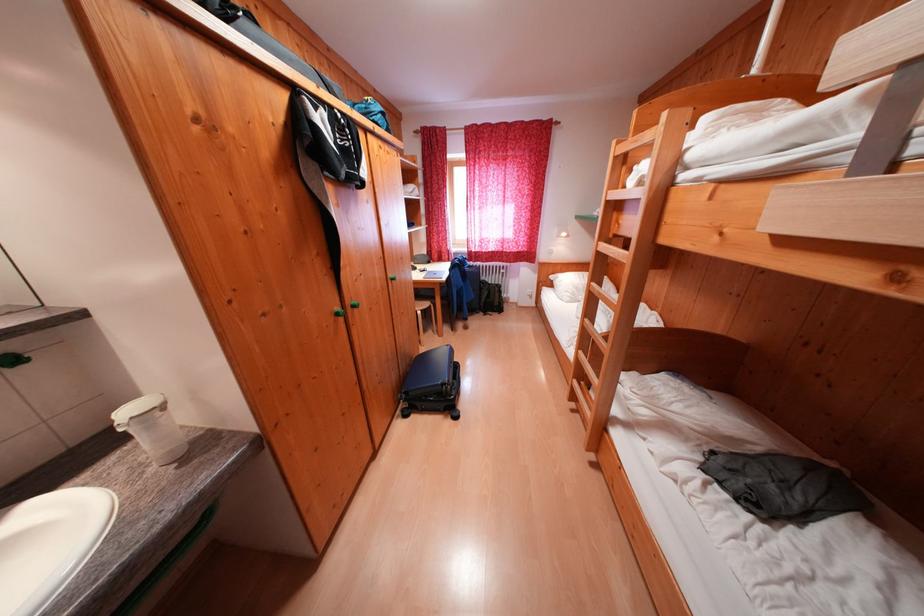
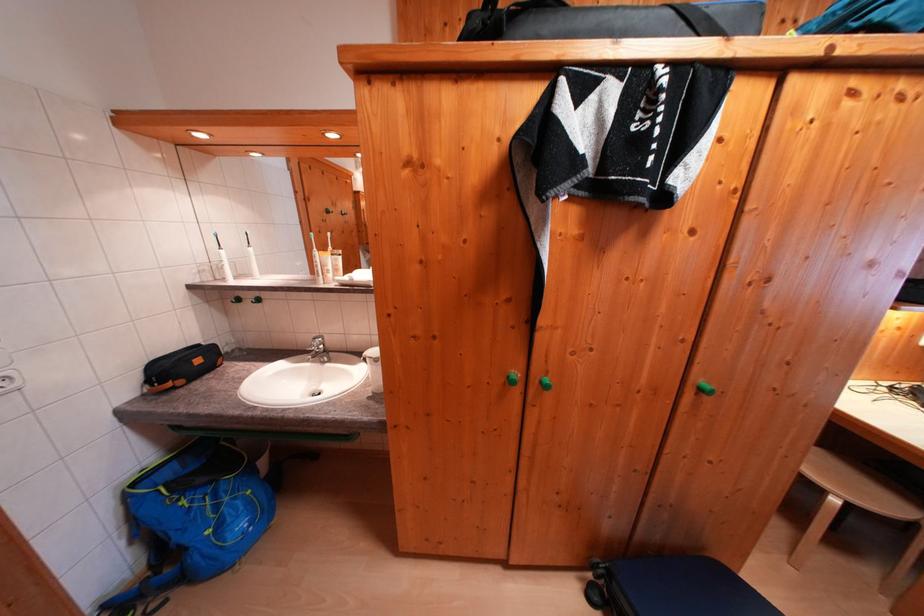
The point at [400,284] is marked in the first image. Where is the corresponding point in the second image?

(709, 394)